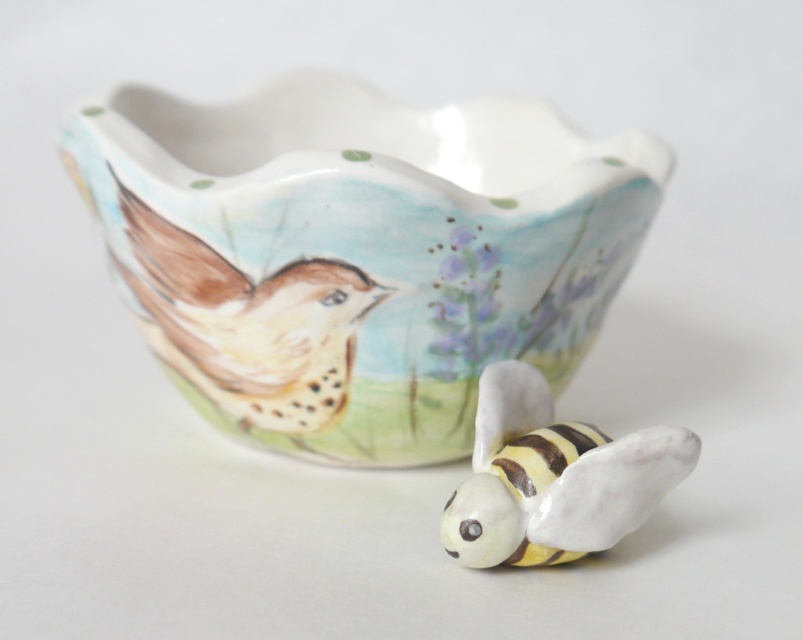
Does point (178, 275) lie behind point (234, 380)?

No, (178, 275) is in front of (234, 380).

Does porcelain bowl at center have a greater width compared to hand-painted ceramic bird at center?

Correct, the width of porcelain bowl at center exceeds that of hand-painted ceramic bird at center.

Does point (210, 358) lie in front of point (153, 308)?

Yes, point (210, 358) is in front of point (153, 308).

Identify the location of porcelain bowl at center. This screenshot has height=640, width=803. (357, 253).

Is point (243, 328) closer to viewer compared to point (473, 451)?

No, it is behind (473, 451).

Is hand-painted ceramic bird at center to the left of white glossy bee at lower right from the viewer's perspective?

Correct, you'll find hand-painted ceramic bird at center to the left of white glossy bee at lower right.

Is point (169, 353) closer to viewer compared to point (549, 404)?

No, (169, 353) is behind (549, 404).

Locate an element on the screen. The height and width of the screenshot is (640, 803). hand-painted ceramic bird at center is located at coordinates (247, 323).

Is the position of porcelain bowl at center more distant than that of white glossy bee at lower right?

Yes.

Measure the distance between point (173, 140) and camera.

Point (173, 140) and camera are 4.62 feet apart.

Does point (219, 403) come in front of point (539, 509)?

That is False.

Where is `porcelain bowl at center`? porcelain bowl at center is located at coordinates tap(357, 253).